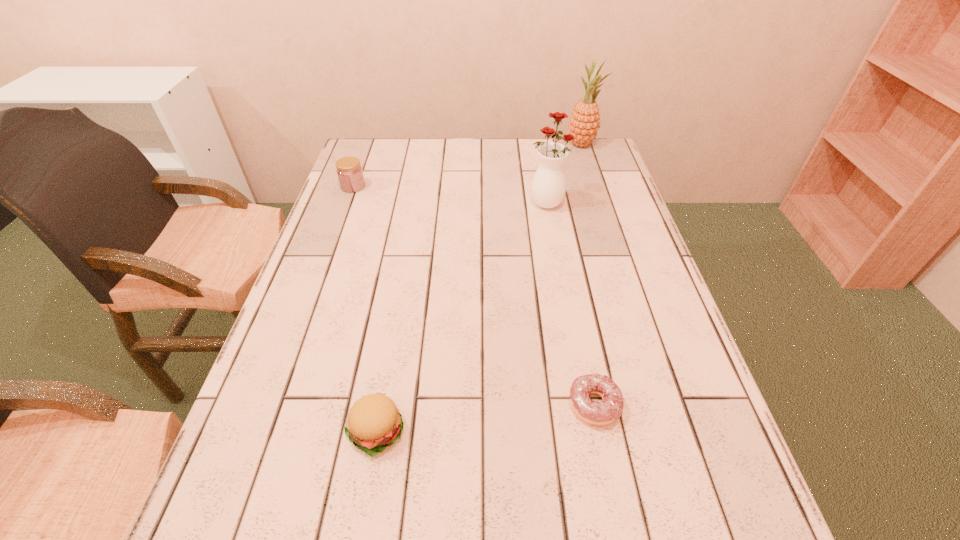
In the image, there is a desktop. Find the location of `vacant space at the right edge`. vacant space at the right edge is located at coordinates (588, 189).

At what (x,y) coordinates should I click in order to perform the action: click on vacant space at the far left corner of the desktop. Please return your answer as a coordinate pair (x, y). The height and width of the screenshot is (540, 960). Looking at the image, I should click on (383, 162).

The height and width of the screenshot is (540, 960). I want to click on vacant space at the far right corner of the desktop, so click(x=588, y=171).

This screenshot has width=960, height=540. Find the location of `unoccupied position between the fourth object from right to left and the pineapple`. unoccupied position between the fourth object from right to left and the pineapple is located at coordinates (478, 288).

Where is `vacant area between the doughnut and the third shortest object`? This screenshot has height=540, width=960. vacant area between the doughnut and the third shortest object is located at coordinates (473, 296).

In order to click on vacant space in between the jam and the fourth object from right to left in this screenshot , I will do `click(364, 308)`.

Find the location of a particular element. This screenshot has height=540, width=960. free spot between the doughnut and the jam is located at coordinates (473, 296).

The height and width of the screenshot is (540, 960). Identify the location of vacant space in between the third shortest object and the doughnut. (473, 296).

Identify the location of empty space between the rightmost object and the leftmost object. (468, 165).

Where is `vacant space in between the vase and the doughnut`? The image size is (960, 540). vacant space in between the vase and the doughnut is located at coordinates (570, 304).